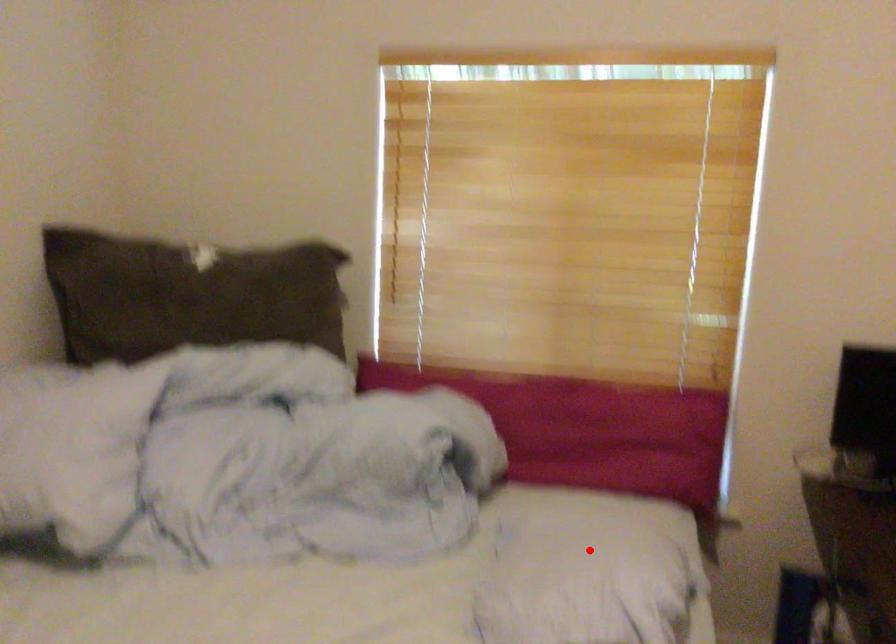
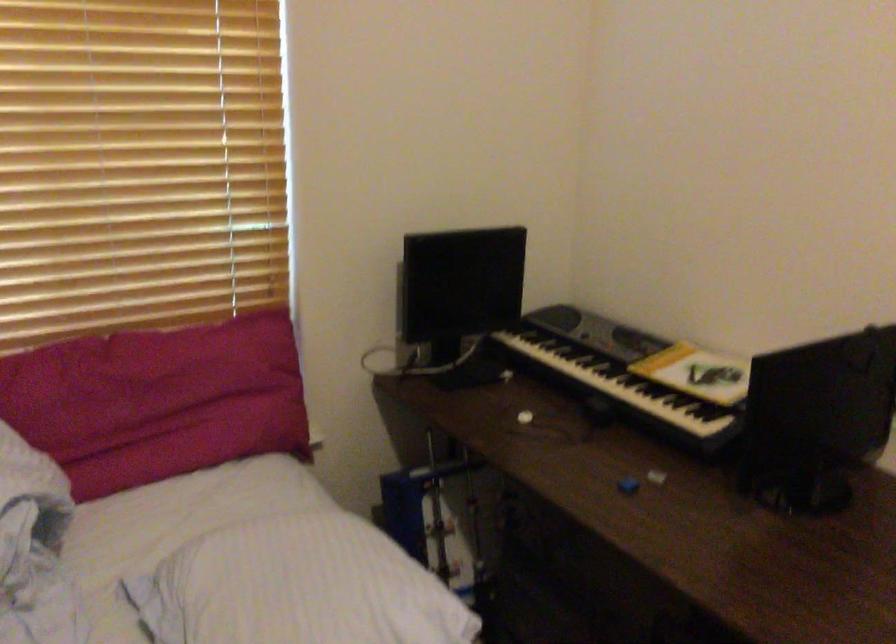
Question: I am providing you with two images of the same scene from different viewpoints. Given a red point in image1, look at the same physical point in image2. Is it:

Choices:
 (A) Closer to the viewpoint
 (B) Farther from the viewpoint

Answer: (A)